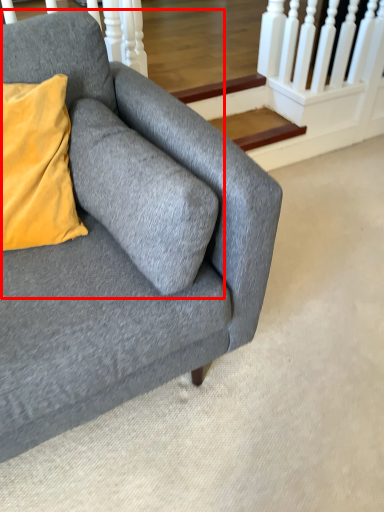
Question: From the image's perspective, where is swivel chair (annotated by the red box) located relative to studio couch?

Choices:
 (A) below
 (B) above

Answer: (B)